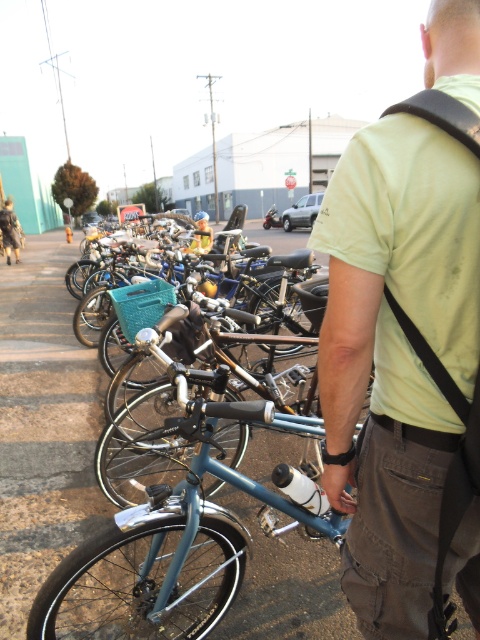
You are standing at point (197, 220) and want to walk to the stop sign further down the street. There is a person holding a bicycle handlebar near point (425, 554). Will you pass by the person holding the bicycle handlebar before reaching the stop sign?

Yes, because point (425, 554) is in front of point (197, 220), so the person is closer to the stop sign than your starting position. Therefore, you would pass by them before reaching the stop sign.